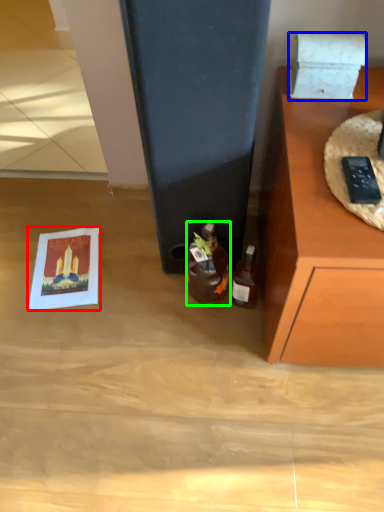
Question: Based on their relative distances, which object is farther from postcard (highlighted by a red box)? Choose from box (highlighted by a blue box) and bottle (highlighted by a green box).

Choices:
 (A) box
 (B) bottle

Answer: (A)